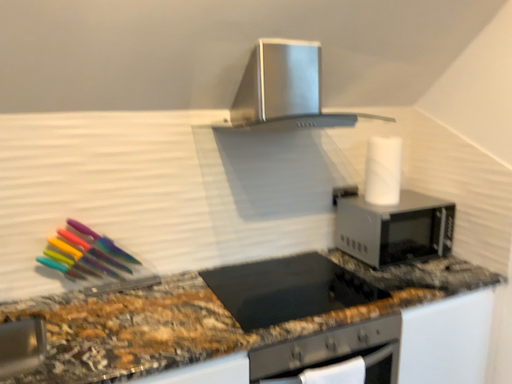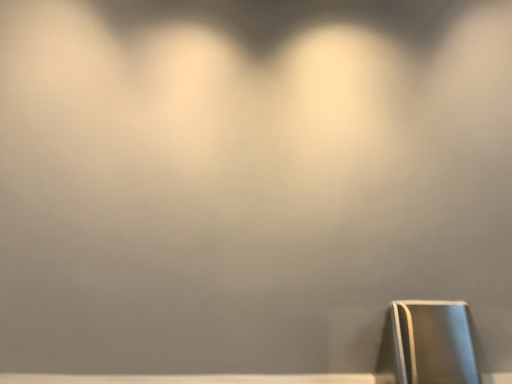
Question: Which way did the camera rotate in the video?

Choices:
 (A) rotated downward
 (B) rotated upward

Answer: (B)